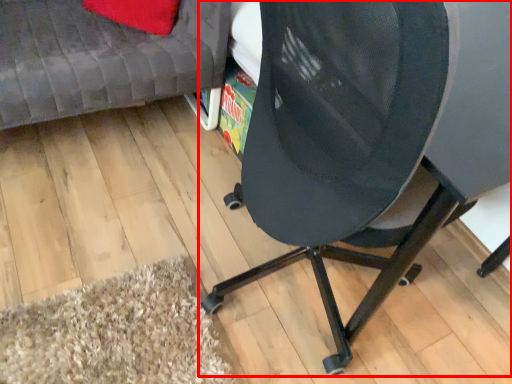
Question: Where is chair (annotated by the red box) located in relation to furniture in the image?

Choices:
 (A) right
 (B) left

Answer: (A)